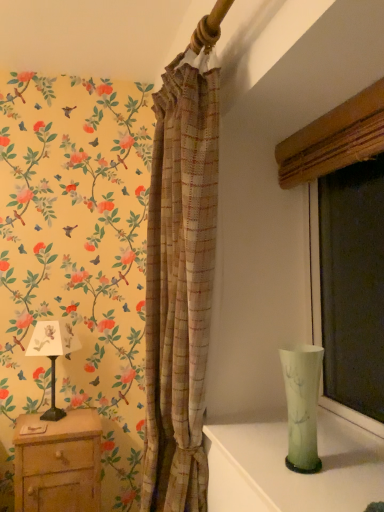
In order to face wooden nightstand at lower left, should I rotate leftwards or rightwards?

Rotate left and turn 17.338 degrees.

This screenshot has width=384, height=512. Describe the element at coordinates (334, 140) in the screenshot. I see `matte wood window frame at right` at that location.

Where is `green glass vase at lower right`? The image size is (384, 512). green glass vase at lower right is located at coordinates (289, 470).

Measure the distance between point [64,336] and camera.

Point [64,336] and camera are 6.62 feet apart.

Find the location of `wooden nightstand at lower left`. wooden nightstand at lower left is located at coordinates (59, 464).

Does plaid fabric curtain at center have a smaller size compared to wooden nightstand at lower left?

Incorrect, plaid fabric curtain at center is not smaller in size than wooden nightstand at lower left.

From a real-world perspective, between plaid fabric curtain at center and wooden nightstand at lower left, who is vertically higher?

In real-world perspective, plaid fabric curtain at center is above.

Considering the positions of objects plaid fabric curtain at center and wooden nightstand at lower left in the image provided, who is in front, plaid fabric curtain at center or wooden nightstand at lower left?

plaid fabric curtain at center is more forward.

Locate an element on the screen. nightstand below the plaid fabric curtain at center (from a real-world perspective) is located at coordinates (59, 464).

From the image's perspective, is white paper lampshade at left under green translucent vase at right?

Yes, from the image's perspective, white paper lampshade at left is below green translucent vase at right.

Measure the distance from white paper lampshade at left to green translucent vase at right.

white paper lampshade at left is 4.22 feet from green translucent vase at right.

Which is correct: white paper lampshade at left is inside green translucent vase at right, or outside of it?

white paper lampshade at left is outside green translucent vase at right.

From a real-world perspective, between white paper lampshade at left and green translucent vase at right, who is vertically lower?

In real-world perspective, white paper lampshade at left is lower.

From the image's perspective, is white paper lampshade at left below plaid fabric curtain at center?

Indeed, from the image's perspective, white paper lampshade at left is shown beneath plaid fabric curtain at center.

Is plaid fabric curtain at center located within white paper lampshade at left?

No, plaid fabric curtain at center is not surrounded by white paper lampshade at left.

Which of these two, white paper lampshade at left or plaid fabric curtain at center, is bigger?

plaid fabric curtain at center is bigger.

Does white paper lampshade at left touch plaid fabric curtain at center?

No.

Considering the relative sizes of green translucent vase at right and green glass vase at lower right in the image provided, is green translucent vase at right wider than green glass vase at lower right?

No.

Does green translucent vase at right have a lesser height compared to green glass vase at lower right?

In fact, green translucent vase at right may be taller than green glass vase at lower right.

Considering the relative positions of green translucent vase at right and green glass vase at lower right in the image provided, is green translucent vase at right in front of green glass vase at lower right?

No.

Is plaid fabric curtain at center at the right side of matte wood window frame at right?

No.

From a real-world perspective, relative to matte wood window frame at right, is plaid fabric curtain at center vertically above or below?

In terms of real-world spatial position, plaid fabric curtain at center is below matte wood window frame at right.

You are a GUI agent. You are given a task and a screenshot of the screen. Output one action in this format:
    pyautogui.click(x=<x>, y=<y>)
    Task: Click on the curtain on the left of matte wood window frame at right
    
    Given the screenshot: What is the action you would take?
    pyautogui.click(x=180, y=284)

Is green translucent vase at right behind wooden nightstand at lower left?

No, it is not.

Is green translucent vase at right thinner than wooden nightstand at lower left?

Yes, green translucent vase at right is thinner than wooden nightstand at lower left.

The height and width of the screenshot is (512, 384). I want to click on glass vase that is above the wooden nightstand at lower left (from a real-world perspective), so click(302, 405).

Relative to green glass vase at lower right, is plaid fabric curtain at center in front or behind?

Clearly, plaid fabric curtain at center is behind green glass vase at lower right.

How many degrees apart are the facing directions of plaid fabric curtain at center and green glass vase at lower right?

The angular difference between plaid fabric curtain at center and green glass vase at lower right is 1.27 degrees.

From the image's perspective, is plaid fabric curtain at center positioned above or below green glass vase at lower right?

Based on their image positions, plaid fabric curtain at center is located above green glass vase at lower right.

Does plaid fabric curtain at center have a smaller size compared to green glass vase at lower right?

Incorrect, plaid fabric curtain at center is not smaller in size than green glass vase at lower right.

The width and height of the screenshot is (384, 512). What are the coordinates of `curtain that is above the wooden nightstand at lower left (from the image's perspective)` in the screenshot? It's located at (180, 284).

Identify the location of table lamp to the left of green translucent vase at right. (52, 354).

Which object lies further to the anchor point plaid fabric curtain at center, matte wood window frame at right or green translucent vase at right?

matte wood window frame at right is positioned further to the anchor plaid fabric curtain at center.

Looking at the image, which one is located further to plaid fabric curtain at center, matte wood window frame at right or white paper lampshade at left?

white paper lampshade at left.

Considering their positions, is plaid fabric curtain at center positioned further to wooden nightstand at lower left than green translucent vase at right?

Based on the image, green translucent vase at right appears to be further to wooden nightstand at lower left.

In the scene shown: Which object lies nearer to the anchor point white paper lampshade at left, green glass vase at lower right or matte wood window frame at right?

green glass vase at lower right.

When comparing their distances from plaid fabric curtain at center, does matte wood window frame at right or green glass vase at lower right seem closer?

The object closer to plaid fabric curtain at center is green glass vase at lower right.

Considering their positions, is white paper lampshade at left positioned further to green translucent vase at right than green glass vase at lower right?

white paper lampshade at left is positioned further to the anchor green translucent vase at right.

Based on their spatial positions, is wooden nightstand at lower left or plaid fabric curtain at center further from green translucent vase at right?

wooden nightstand at lower left lies further to green translucent vase at right than the other object.

Which object lies further to the anchor point matte wood window frame at right, green glass vase at lower right or wooden nightstand at lower left?

wooden nightstand at lower left.

Where is `glass vase situated between wooden nightstand at lower left and matte wood window frame at right from left to right`? The width and height of the screenshot is (384, 512). glass vase situated between wooden nightstand at lower left and matte wood window frame at right from left to right is located at coordinates (302, 405).

Where is `curtain between wooden nightstand at lower left and green translucent vase at right in the horizontal direction`? This screenshot has width=384, height=512. curtain between wooden nightstand at lower left and green translucent vase at right in the horizontal direction is located at coordinates (180, 284).

Image resolution: width=384 pixels, height=512 pixels. I want to click on curtain between green glass vase at lower right and wooden nightstand at lower left along the z-axis, so click(180, 284).

Find the location of a particular element. glass vase located between white paper lampshade at left and matte wood window frame at right in the left-right direction is located at coordinates (302, 405).